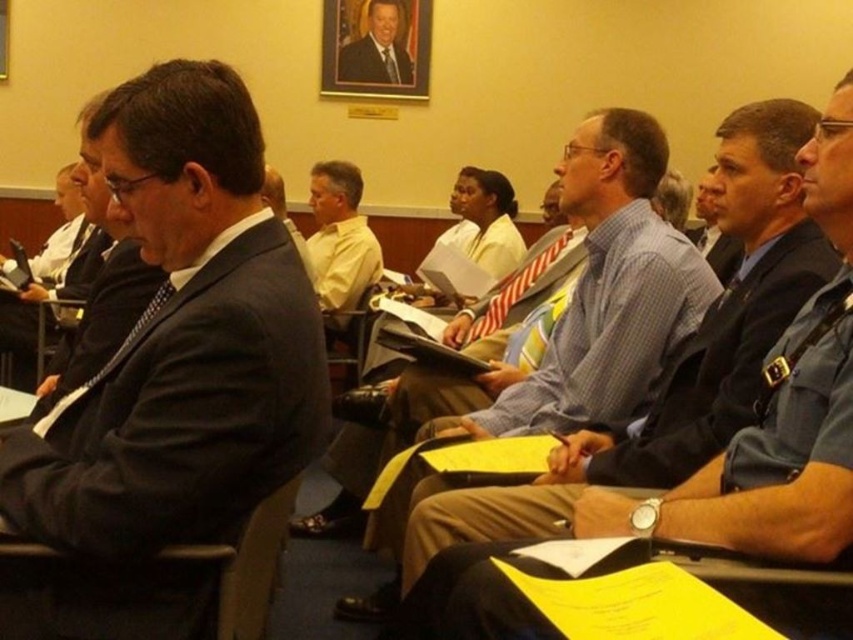
You are an event organizer who needs to arrange name tags for attendees. You see the blue uniform shirt at center and the matte black suit at center. Which attendee is sitting lower in their seat?

The blue uniform shirt at center is sitting lower in their seat because the blue uniform shirt at center is below the matte black suit at center.

Consider the image. You are standing in the conference room and want to walk to both the point at coordinates (225, 621) and the point at coordinates (358, 74). Which point should you reach first to minimize your walking distance?

You should reach the point at coordinates (225, 621) first because it is closer to you than the point at coordinates (358, 74).

You are a professional photographer who needs to capture a closeup shot of the smooth black suit at center without including the dark gray fabric chair at center in the frame. Given their positions, is this possible?

The dark gray fabric chair at center is thinner than the smooth black suit at center, so the chair is narrower. Since the chair is thinner, it might be possible to position the camera in a way that only captures the suit while avoiding the chair, depending on their exact spatial arrangement and angles available.